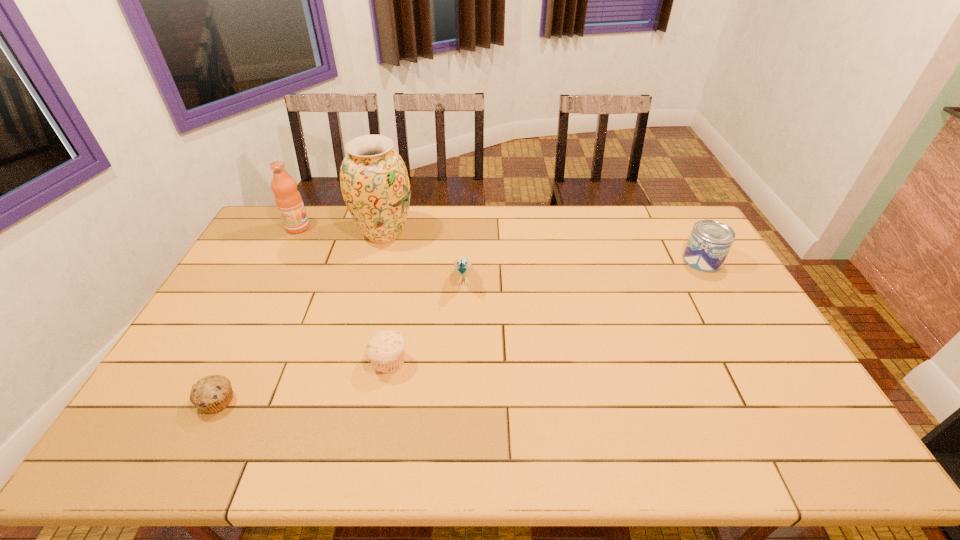
At what (x,y) coordinates should I click in order to perform the action: click on the tallest object. Please return your answer as a coordinate pair (x, y). Looking at the image, I should click on (374, 181).

Identify the location of fruit juice. (289, 202).

I want to click on the fifth object from left to right, so click(x=462, y=264).

This screenshot has width=960, height=540. I want to click on the fourth tallest object, so click(710, 241).

Image resolution: width=960 pixels, height=540 pixels. Find the location of `can`. can is located at coordinates (710, 241).

This screenshot has width=960, height=540. I want to click on the second nearest object, so click(385, 350).

Where is `the farther muffin`? The height and width of the screenshot is (540, 960). the farther muffin is located at coordinates (385, 350).

Find the location of a particular element. The height and width of the screenshot is (540, 960). the left muffin is located at coordinates (211, 394).

This screenshot has width=960, height=540. What are the coordinates of `the shorter muffin` in the screenshot? It's located at [x=211, y=394].

Identify the location of vacant space located on the front of the vase. This screenshot has height=540, width=960. (372, 282).